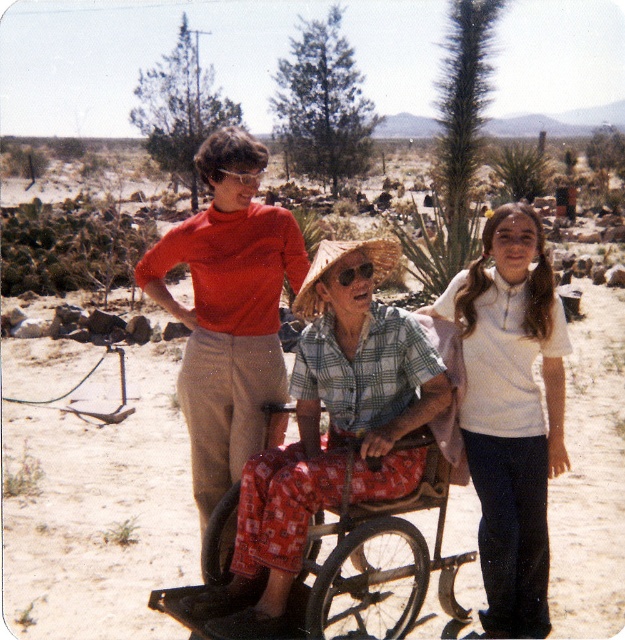
Question: Does strawmaterial/texturehat at center have a larger size compared to clear plastic goggles at center?

Choices:
 (A) no
 (B) yes

Answer: (B)

Question: Which of the following is the farthest from the observer?

Choices:
 (A) plaid cotton shirt at center
 (B) strawmaterial/texturehat at center
 (C) plaid fabric wheelchair at center

Answer: (C)

Question: Is plaid cotton shirt at center positioned at the back of clear plastic goggles at center?

Choices:
 (A) yes
 (B) no

Answer: (B)

Question: Which object is closer to the camera taking this photo?

Choices:
 (A) white cotton shirt at center
 (B) strawmaterial/texturehat at center
 (C) clear plastic goggles at center
 (D) plaid cotton shirt at center

Answer: (D)

Question: Among these objects, which one is nearest to the camera?

Choices:
 (A) plaid cotton shirt at center
 (B) strawmaterial/texturehat at center
 (C) plaid fabric wheelchair at center

Answer: (A)

Question: Does plaid cotton shirt at center have a lesser width compared to white cotton shirt at center?

Choices:
 (A) no
 (B) yes

Answer: (A)